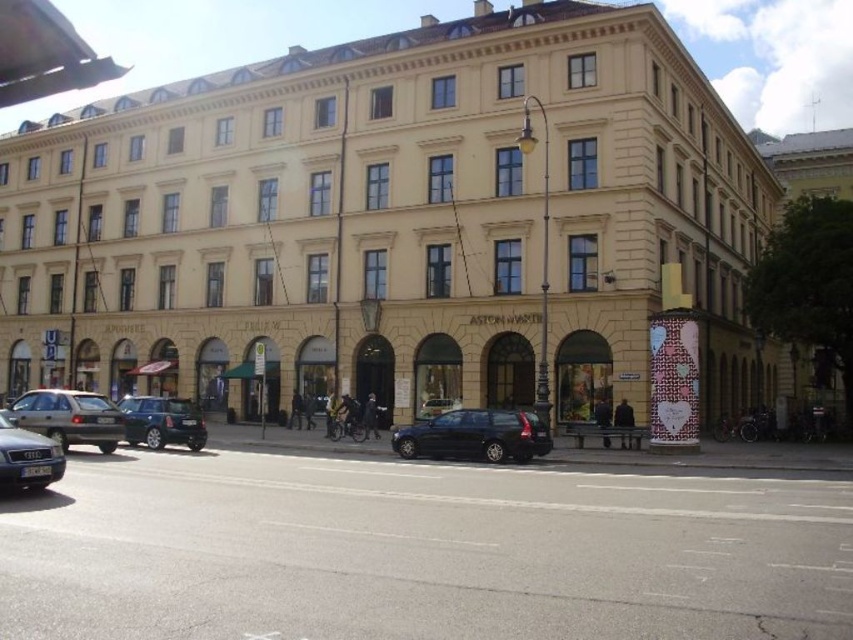
Question: Does matte silver car at lower left have a lesser width compared to matte black car at lower left?

Choices:
 (A) no
 (B) yes

Answer: (A)

Question: Based on their relative distances, which object is nearer to the matte black car at lower left?

Choices:
 (A) metallic silver hatchback at center-left
 (B) shiny black station wagon at center

Answer: (A)

Question: Which of these objects is positioned closest to the beige stone building at center?

Choices:
 (A) shiny black station wagon at center
 (B) metallic silver hatchback at center-left
 (C) matte black car at lower left
 (D) matte silver car at lower left

Answer: (A)

Question: Among these points, which one is farthest from the camera?

Choices:
 (A) (462, 456)
 (B) (152, 433)
 (C) (54, 419)

Answer: (B)

Question: Can you confirm if shiny black station wagon at center is bigger than matte silver car at lower left?

Choices:
 (A) yes
 (B) no

Answer: (B)

Question: Does beige stone building at center appear on the left side of shiny black station wagon at center?

Choices:
 (A) yes
 (B) no

Answer: (A)